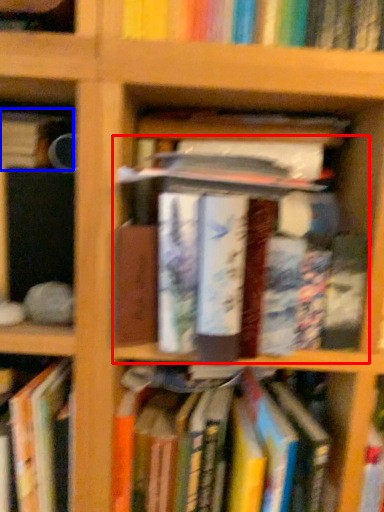
Question: Which point is further to the camera, book (highlighted by a red box) or book (highlighted by a blue box)?

Choices:
 (A) book
 (B) book

Answer: (B)